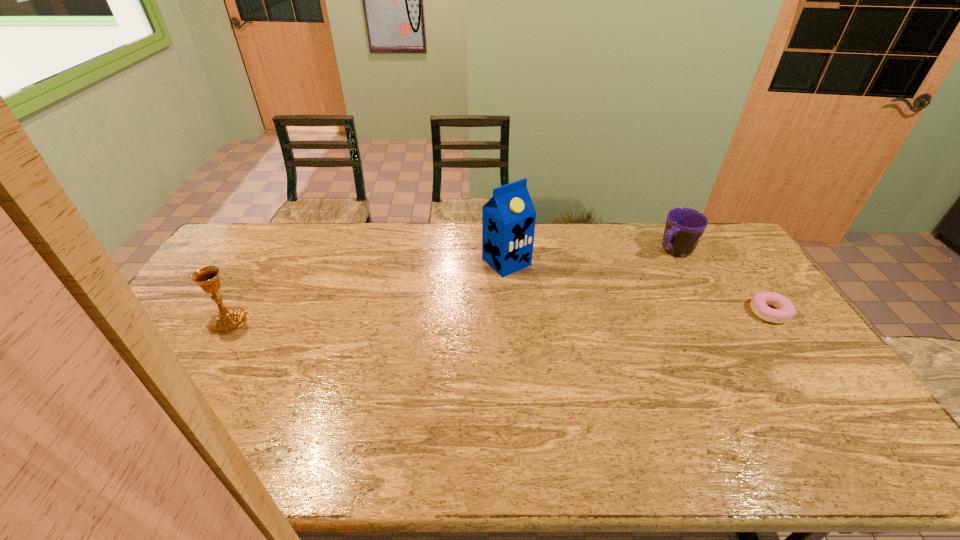
What are the coordinates of `mug present at the right edge` in the screenshot? It's located at (684, 227).

I want to click on object at the far right corner, so coord(684,227).

Image resolution: width=960 pixels, height=540 pixels. I want to click on free space at the far edge of the desktop, so click(392, 255).

Find the location of `free location at the left edge of the desktop`. free location at the left edge of the desktop is located at coordinates (175, 340).

This screenshot has height=540, width=960. In order to click on vacant space at the right edge of the desktop in this screenshot , I will do `click(775, 359)`.

This screenshot has width=960, height=540. What are the coordinates of `free location at the far right corner` in the screenshot? It's located at (700, 240).

In the image, there is a desktop. What are the coordinates of `free space at the near right corner` in the screenshot? It's located at (855, 414).

Identify the location of free space between the pastry and the carton. (637, 287).

The height and width of the screenshot is (540, 960). Find the location of `vacant region between the leftmost object and the rightmost object`. vacant region between the leftmost object and the rightmost object is located at coordinates (499, 316).

You are a GUI agent. You are given a task and a screenshot of the screen. Output one action in this format:
    pyautogui.click(x=<x>, y=<y>)
    Task: Click on the vacant area that lies between the pastry and the third tallest object
    
    Given the screenshot: What is the action you would take?
    pyautogui.click(x=721, y=281)